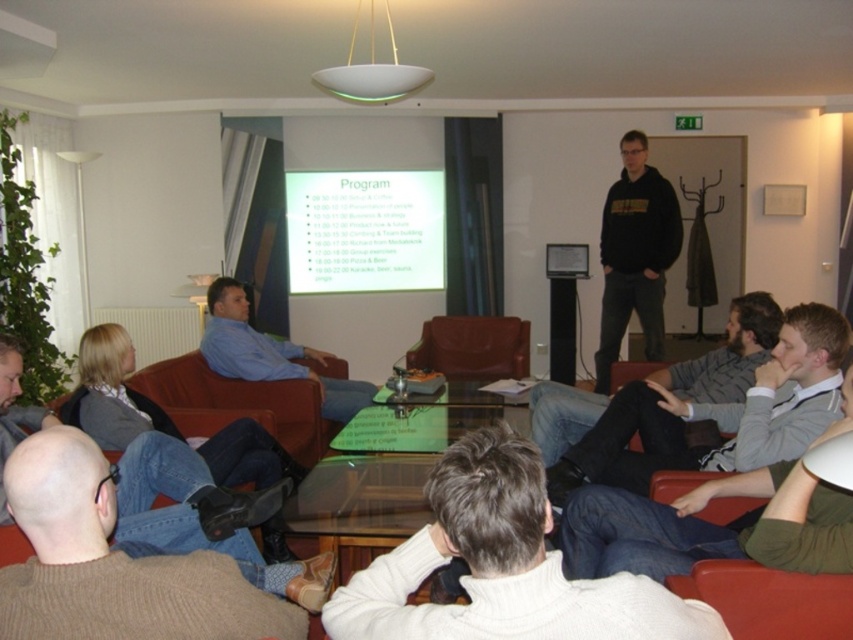
You are organizing a small event and need to ensure there is enough space between the blue shirt at center and the leather at center for attendees to move comfortably. According to the image, what is the minimum distance you should leave between them?

The minimum distance you should leave between the blue shirt at center and the leather at center is 37.10 inches, as that is the distance observed in the image.

Looking at this image, you are organizing a photo shoot and need to place a small decorative pillow on the sofa. The sofa has two sections with the blue shirt at center and leather at center. Which section should you choose to ensure the pillow is not too crowded?

The blue shirt at center is bigger than the leather at center, so placing the pillow on the blue shirt at center section would provide more space and less crowding.

You are standing at the center of the room and want to move towards the blue denim jeans at lower left. Which direction should you walk to reach them?

To reach the blue denim jeans at lower left, you should walk towards the lower left direction from the center of the room since their 2D location is at point (181,500).